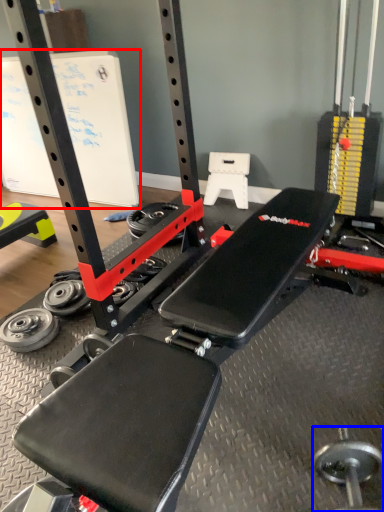
Question: Which of the following is the closest to the observer, bulletin board (highlighted by a red box) or dumbbell (highlighted by a blue box)?

Choices:
 (A) bulletin board
 (B) dumbbell

Answer: (B)